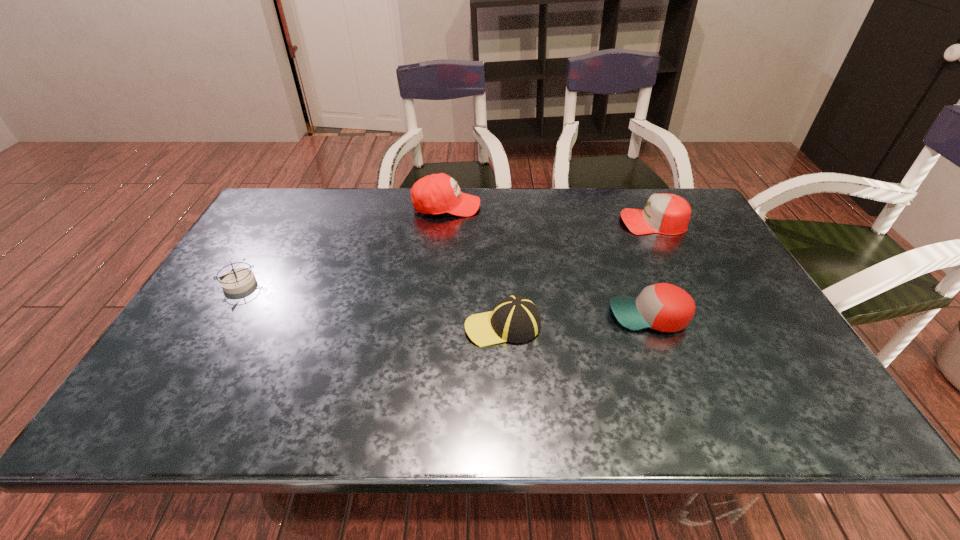
The height and width of the screenshot is (540, 960). I want to click on the tallest object, so click(439, 193).

Find the location of a particular element. This screenshot has width=960, height=540. the leftmost object is located at coordinates (238, 280).

Find the location of a particular element. The width and height of the screenshot is (960, 540). the third nearest object is located at coordinates (238, 280).

Where is `free space located on the front panel of the tallest baseball cap`? The width and height of the screenshot is (960, 540). free space located on the front panel of the tallest baseball cap is located at coordinates (514, 206).

Where is `free space located 0.120m on the front of the shortest object`? free space located 0.120m on the front of the shortest object is located at coordinates (212, 329).

Identify the location of object situated at the left edge. (238, 280).

This screenshot has width=960, height=540. Find the location of `object that is positioned at the right edge`. object that is positioned at the right edge is located at coordinates (668, 214).

This screenshot has width=960, height=540. I want to click on object present at the far right corner, so click(668, 214).

The height and width of the screenshot is (540, 960). What are the coordinates of `free space at the far edge of the desktop` in the screenshot? It's located at (322, 200).

Locate an element on the screen. The height and width of the screenshot is (540, 960). free space at the near edge of the desktop is located at coordinates (522, 411).